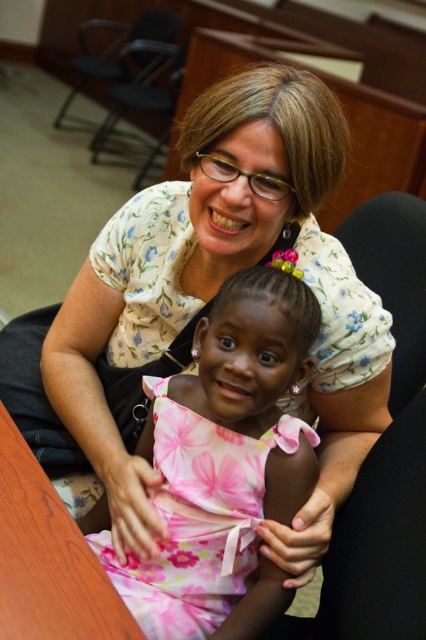
You are a photographer setting up a photo shoot. You have a pink floral fabric dress at center and a wooden table at lower left in the scene. Which object is taller when comparing their heights?

The pink floral fabric dress at center is much taller than the wooden table at lower left.

You are a photographer trying to capture the child in the center wearing the pink floral fabric dress at center. The camera is set to focus on the point at coordinates point (198, 518). Will the focus point be on the child?

Yes, the focus point at point (198, 518) will be on the child because the point corresponds to the pink floral fabric dress at center, which the child is wearing.

You are setting up a photo shoot and want to ensure the pink floral fabric dress at center is visible in the frame. Is there any obstruction from the wooden table at lower left that might block the view of the dress?

The pink floral fabric dress at center is positioned under the wooden table at lower left, so the table may obstruct the view of the dress depending on the camera angle.